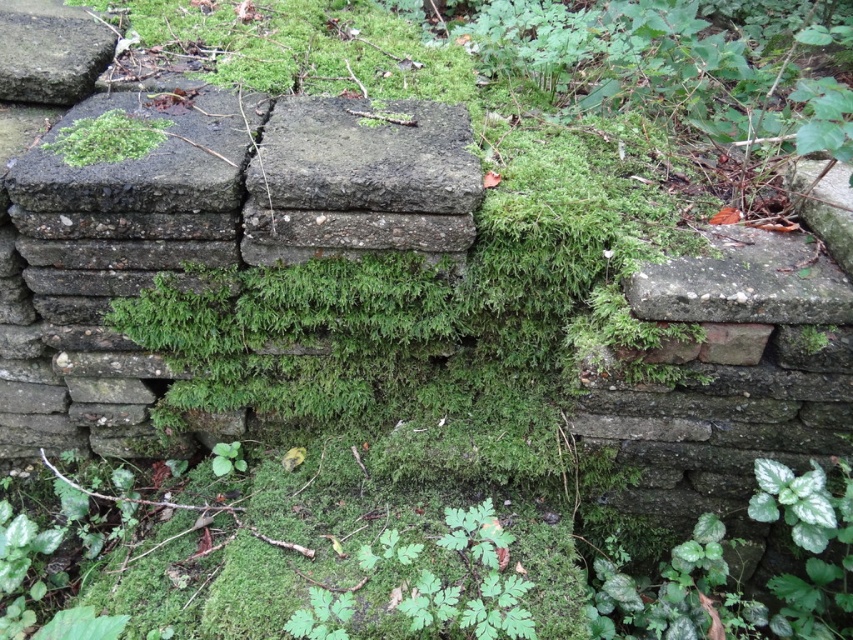
You are a gardener who needs to place a 12 inch wide decorative rock between the smooth gray stone at upper left and the green mossy patch at upper left. Can the rock fit in the space between them?

The distance between the smooth gray stone at upper left and the green mossy patch at upper left is 13.39 inches. Since the decorative rock is 12 inches wide, it can fit in the space between them as the available space is wider than the rock.

You are a construction worker assessing the stability of the wall. The rough concrete block at center and the green mossy patch at upper left are key elements. Which of these two elements is taller?

The rough concrete block at center is taller than the green mossy patch at upper left according to the description provided.